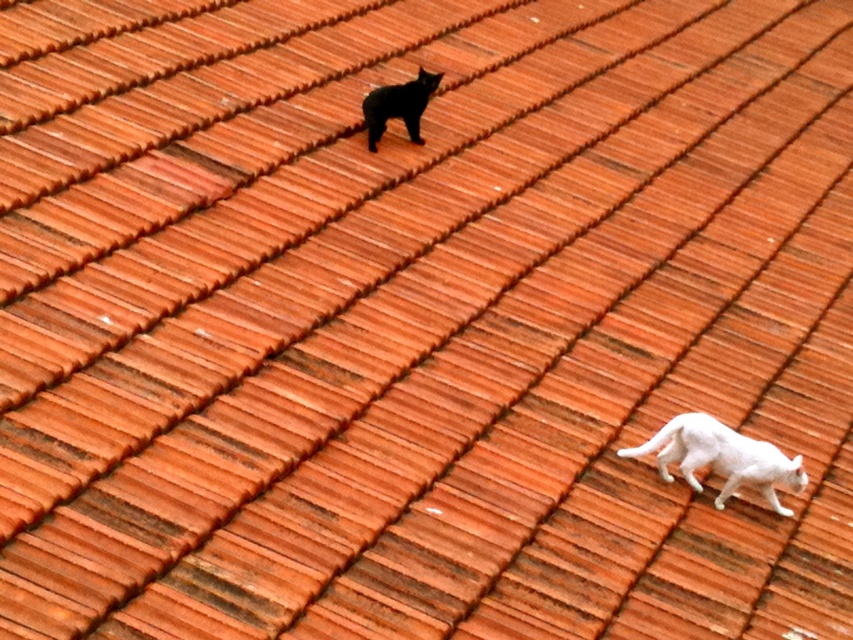
You are a photographer trying to capture both the white matte cat at lower right and the black matte cat at upper center in a single frame. Which cat will appear larger in the photo?

The white matte cat at lower right will appear larger in the photo because its actual width is larger than the black matte cat at upper center.